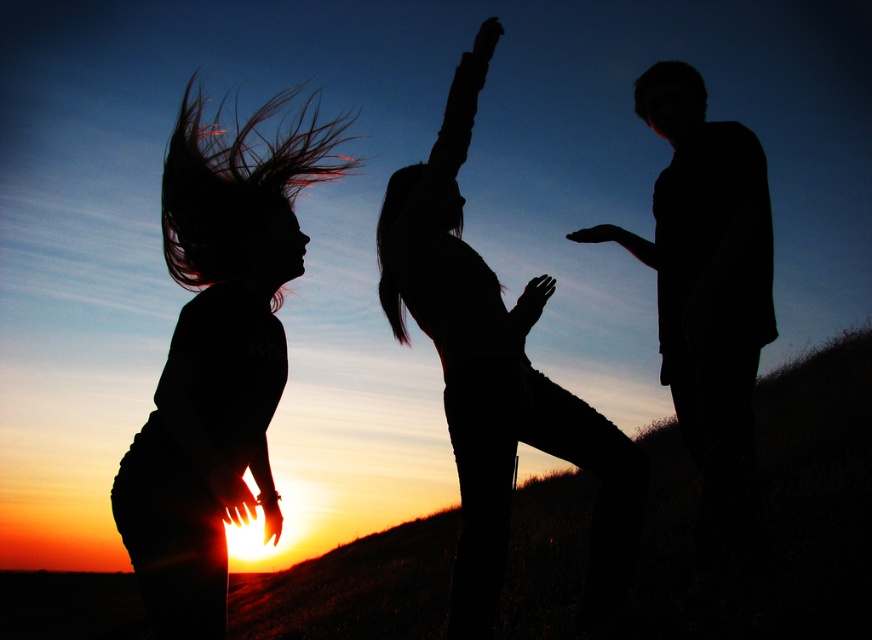
You are a photographer trying to capture the scene. You want to ensure that both the silhouette yoga pose at center and the silhouette man at right are visible in your shot. Based on their positions, which one is closer to the left edge of the frame?

The silhouette yoga pose at center is to the left of the silhouette man at right, so it is closer to the left edge of the frame.

You are a photographer trying to capture a group photo of the silhouette yoga pose at center and the silhouette man at right. If you want to ensure both subjects are fully visible in the frame, which subject should you position closer to the camera?

The silhouette yoga pose at center is wider than the silhouette man at right, so positioning the silhouette yoga pose at center closer to the camera will help ensure both subjects are fully visible in the frame.

Based on the photo, you are a photographer trying to capture the scene. You notice the black matte hair at left and the silhouette man at right. Which object has a narrower width in the image?

The black matte hair at left has a narrower width than the silhouette man at right.